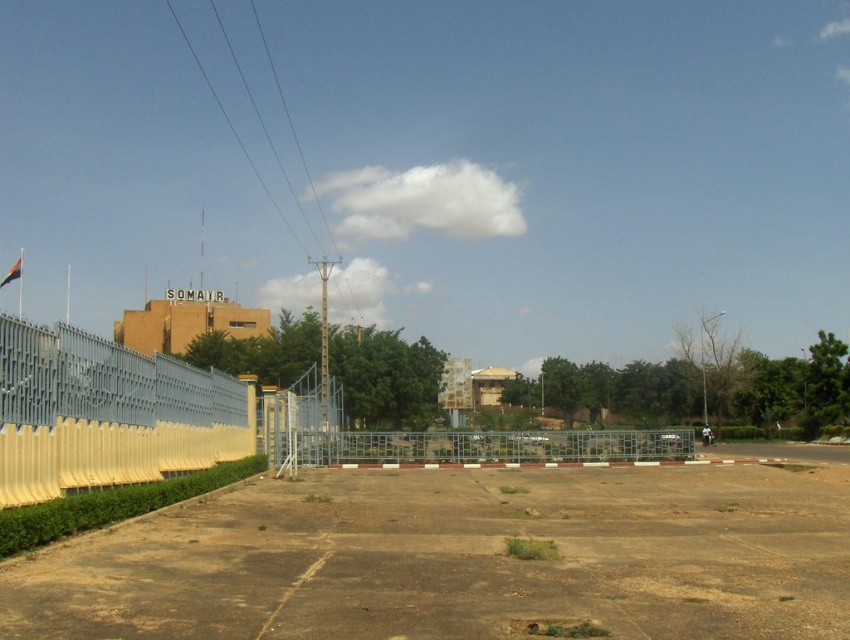
You are standing at the metal fence with a yellow barrier on the left side of the image. You see two points marked in the scene, point 1 at coordinates point 1 at point (194, 387) and point 2 at point (61, 460). Which point is closer to you?

Point 1 at point (194, 387) is closer to you because it is further to the viewer than point 2 at point (61, 460).

You are a delivery driver who needs to park your vehicle on the brown dirt field at lower center. Before doing so, you must ensure that the metallic grid fence at center is not blocking your path. Based on the scene description, can you safely park there?

The brown dirt field at lower center is located above the metallic grid fence at center, meaning the fence is below the field. Since the fence is not in the path leading to the field, you can safely park there.

You are a delivery person trying to access the SOMAIR building. You notice a white plastic barrier at left and a metallic grid fence at center. Which object is taller and could potentially block your view of the building?

The white plastic barrier at left is taller than the metallic grid fence at center, so it could potentially block your view of the building.